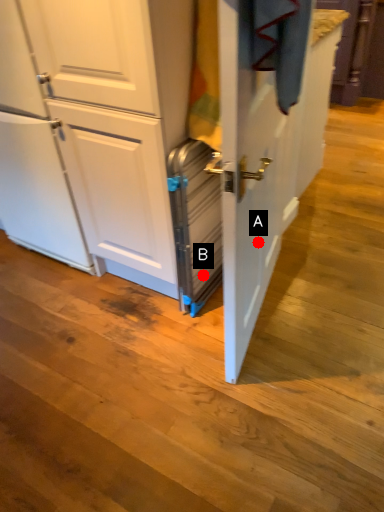
Question: Two points are circled on the image, labeled by A and B beside each circle. Which point is further to the camera?

Choices:
 (A) A is further
 (B) B is further

Answer: (B)